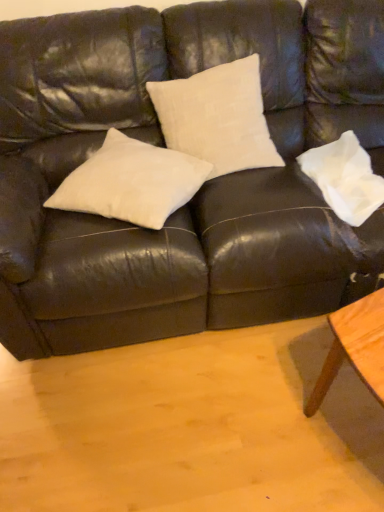
Question: From a real-world perspective, is white cotton pillow at right, marked as the 1th pillow in a right-to-left arrangement, positioned over white cotton pillow at center, the first pillow in the left-to-right sequence, based on gravity?

Choices:
 (A) no
 (B) yes

Answer: (A)

Question: From a real-world perspective, is white cotton pillow at right, the 2th pillow viewed from the left, below white cotton pillow at center, placed as the 2th pillow when sorted from right to left?

Choices:
 (A) no
 (B) yes

Answer: (B)

Question: Considering the relative sizes of white cotton pillow at right, the 2th pillow viewed from the left, and white cotton pillow at center, the first pillow in the left-to-right sequence, in the image provided, is white cotton pillow at right, the 2th pillow viewed from the left, thinner than white cotton pillow at center, the first pillow in the left-to-right sequence,?

Choices:
 (A) yes
 (B) no

Answer: (B)

Question: Can you confirm if white cotton pillow at right, marked as the 1th pillow in a right-to-left arrangement, is bigger than white cotton pillow at center, placed as the 2th pillow when sorted from right to left?

Choices:
 (A) yes
 (B) no

Answer: (B)

Question: From the image's perspective, is white cotton pillow at right, the 2th pillow viewed from the left, on white cotton pillow at center, placed as the 2th pillow when sorted from right to left?

Choices:
 (A) no
 (B) yes

Answer: (B)

Question: Does white cotton pillow at right, the 2th pillow viewed from the left, come behind white cotton pillow at center, the first pillow in the left-to-right sequence?

Choices:
 (A) yes
 (B) no

Answer: (A)

Question: Could you tell me if white cotton pillow at center, the first pillow in the left-to-right sequence, is turned towards matte black leather couch at center?

Choices:
 (A) yes
 (B) no

Answer: (A)

Question: Considering the relative positions of white cotton pillow at center, placed as the 2th pillow when sorted from right to left, and matte black leather couch at center in the image provided, is white cotton pillow at center, placed as the 2th pillow when sorted from right to left, in front of matte black leather couch at center?

Choices:
 (A) yes
 (B) no

Answer: (B)

Question: Considering the relative sizes of white cotton pillow at center, the first pillow in the left-to-right sequence, and matte black leather couch at center in the image provided, is white cotton pillow at center, the first pillow in the left-to-right sequence, thinner than matte black leather couch at center?

Choices:
 (A) yes
 (B) no

Answer: (A)

Question: Is white cotton pillow at center, the first pillow in the left-to-right sequence, not inside matte black leather couch at center?

Choices:
 (A) yes
 (B) no

Answer: (B)

Question: Considering the relative sizes of white cotton pillow at center, the first pillow in the left-to-right sequence, and matte black leather couch at center in the image provided, is white cotton pillow at center, the first pillow in the left-to-right sequence, taller than matte black leather couch at center?

Choices:
 (A) no
 (B) yes

Answer: (A)

Question: Considering the relative sizes of white cotton pillow at center, the first pillow in the left-to-right sequence, and matte black leather couch at center in the image provided, is white cotton pillow at center, the first pillow in the left-to-right sequence, wider than matte black leather couch at center?

Choices:
 (A) no
 (B) yes

Answer: (A)

Question: Can you confirm if matte black leather couch at center is positioned to the left of white cotton pillow at right, the 2th pillow viewed from the left?

Choices:
 (A) yes
 (B) no

Answer: (A)